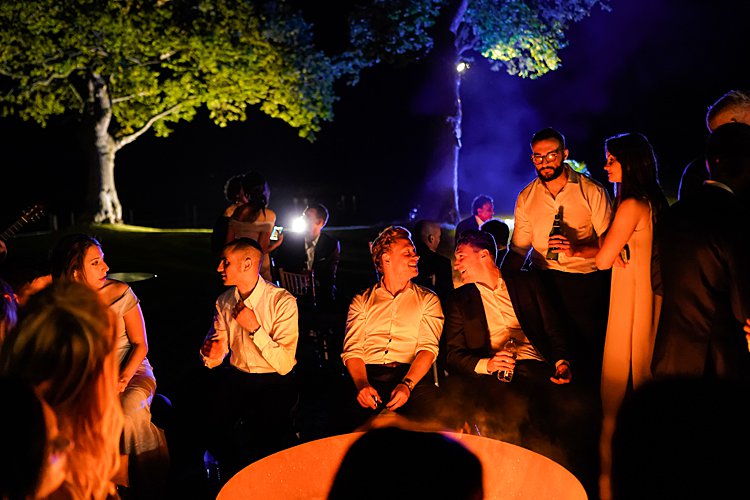
Locate an element on the screen. This screenshot has width=750, height=500. table is located at coordinates (301, 471).